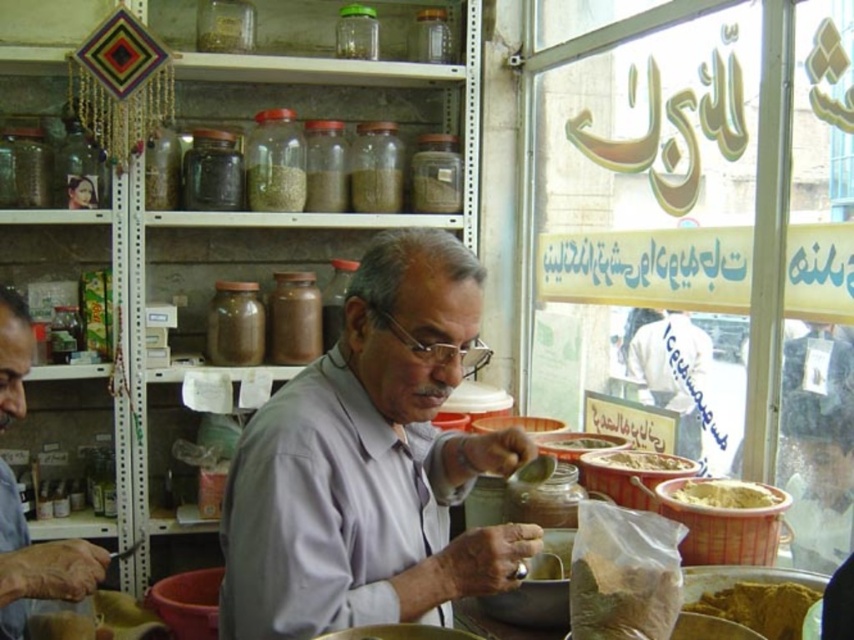
Does translucent glass jar at center lie behind transparent glass jar at upper center?

That is True.

Is translucent glass jar at center thinner than transparent glass jar at upper center?

Incorrect, translucent glass jar at center's width is not less than transparent glass jar at upper center's.

Measure the distance between translucent glass jar at center and camera.

translucent glass jar at center and camera are 2.66 meters apart from each other.

Find the location of a particular element. The height and width of the screenshot is (640, 854). translucent glass jar at center is located at coordinates (375, 189).

Between transparent glass jar at upper center and smooth brown paste at center, which one appears on the right side from the viewer's perspective?

smooth brown paste at center is more to the right.

Is transparent glass jar at upper center above smooth brown paste at center?

Correct, transparent glass jar at upper center is located above smooth brown paste at center.

Which is in front, point (372, 26) or point (609, 440)?

Positioned in front is point (609, 440).

At what (x,y) coordinates should I click in order to perform the action: click on transparent glass jar at upper center. Please return your answer as a coordinate pair (x, y). The image size is (854, 640). Looking at the image, I should click on (355, 33).

Does gray matte shirt at center appear over brown textured bowl at lower right?

Indeed, gray matte shirt at center is positioned over brown textured bowl at lower right.

Who is higher up, gray matte shirt at center or brown textured bowl at lower right?

gray matte shirt at center is higher up.

What do you see at coordinates (370, 464) in the screenshot? This screenshot has width=854, height=640. I see `gray matte shirt at center` at bounding box center [370, 464].

This screenshot has height=640, width=854. I want to click on gray matte shirt at center, so click(370, 464).